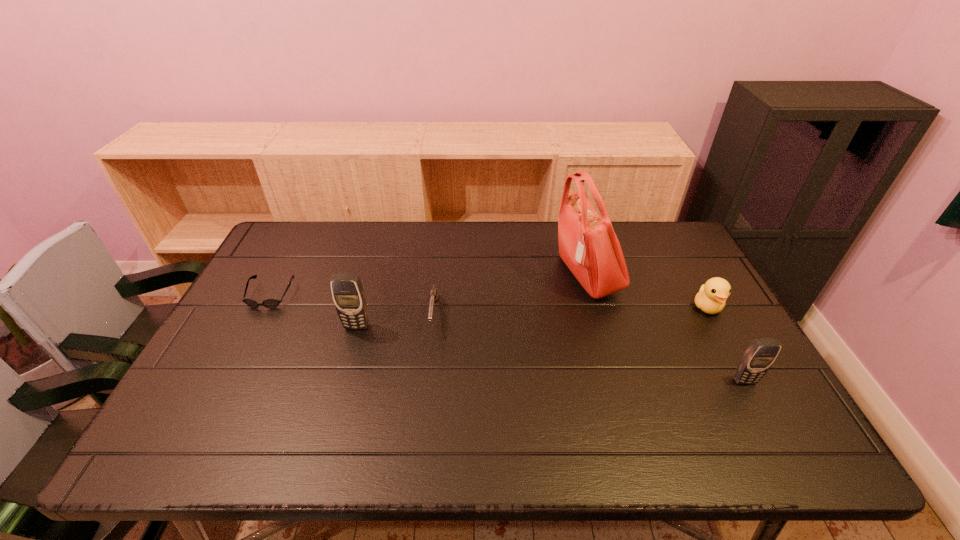
Find the location of a particular element. This screenshot has width=960, height=540. duck is located at coordinates (712, 295).

Locate an element on the screen. The image size is (960, 540). free space located 0.110m on the front face of the second tallest object is located at coordinates (347, 363).

Identify the location of vacant space located 0.080m on the front face of the nearer cellular telephone. (763, 415).

What are the coordinates of `vacant area situated on the front-facing side of the handbag` in the screenshot? It's located at (501, 275).

This screenshot has width=960, height=540. I want to click on vacant space located 0.120m on the front-facing side of the handbag, so click(516, 275).

Locate an element on the screen. This screenshot has height=540, width=960. vacant position located on the front-facing side of the handbag is located at coordinates (526, 275).

This screenshot has height=540, width=960. What are the coordinates of `blank space located 0.070m aiming along the barrel of the gun` in the screenshot? It's located at (429, 356).

At what (x,y) coordinates should I click in order to perform the action: click on free region located 0.100m on the lenses of the sunglasses. Please return your answer as a coordinate pair (x, y). Looking at the image, I should click on (249, 336).

The image size is (960, 540). I want to click on vacant space located 0.210m on the face of the duck, so click(x=749, y=383).

Find the location of a particular element. The height and width of the screenshot is (540, 960). object present at the far edge is located at coordinates 588,245.